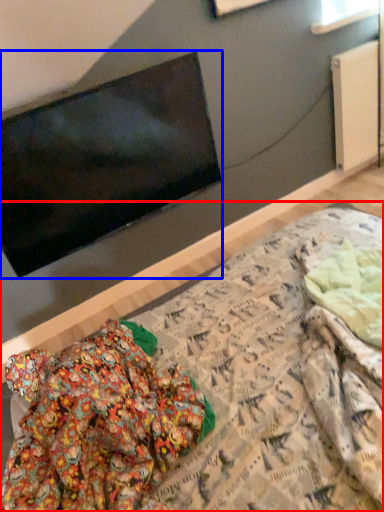
Question: Which object appears closest to the camera in this image, bed (highlighted by a red box) or television (highlighted by a blue box)?

Choices:
 (A) bed
 (B) television

Answer: (A)